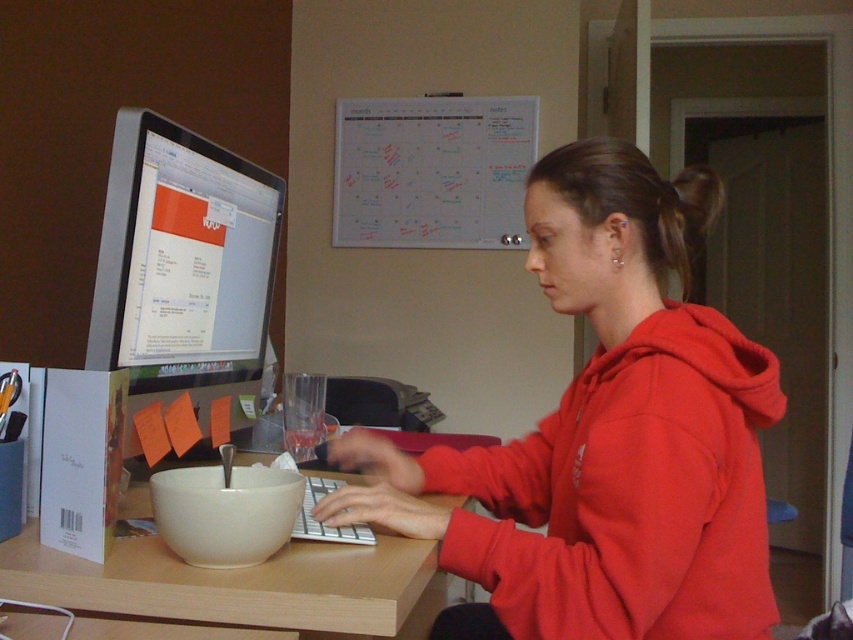
Question: Among these points, which one is farthest from the camera?

Choices:
 (A) [553, 216]
 (B) [201, 209]

Answer: (B)

Question: Which object is positioned closest to the wooden table at center?

Choices:
 (A) satin black monitor at left
 (B) red matte hoodie at center

Answer: (B)

Question: Which object is the closest to the wooden table at center?

Choices:
 (A) red matte hoodie at center
 (B) satin black monitor at left

Answer: (A)

Question: Is red matte hoodie at center positioned in front of satin black monitor at left?

Choices:
 (A) yes
 (B) no

Answer: (A)

Question: Does red matte hoodie at center appear under wooden table at center?

Choices:
 (A) yes
 (B) no

Answer: (B)

Question: Is satin black monitor at left bigger than wooden table at center?

Choices:
 (A) yes
 (B) no

Answer: (B)